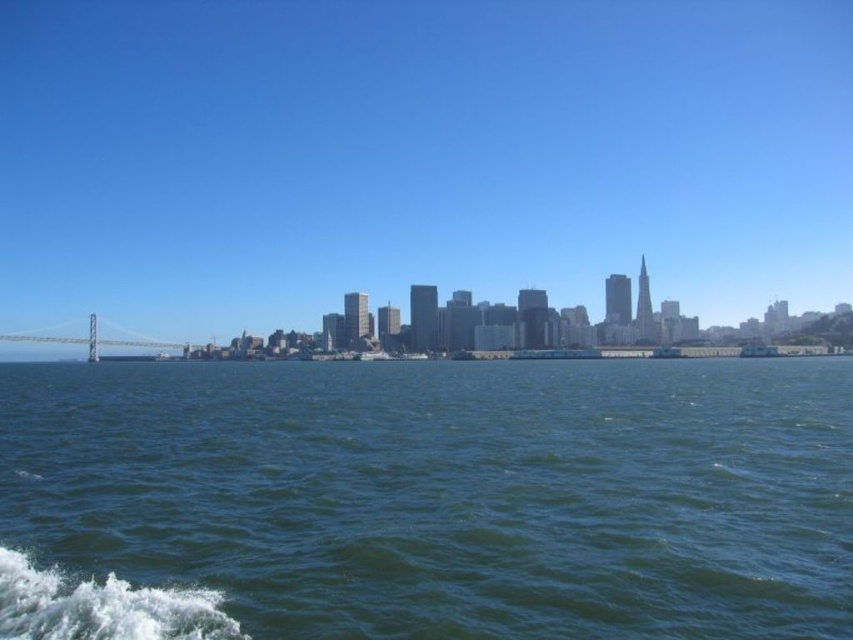
You are on a boat and want to take a photo of both the green water at center and the metallic gray bridge at left. Which object should you focus on first to ensure both are in the frame?

Since the green water at center is closer to the viewer than the metallic gray bridge at left, you should focus on the metallic gray bridge at left first to ensure both are in the frame.

You are an architect observing the city skyline from a boat. You notice the blue sky at upper center and the green water at center. Which of these two elements is located to the right when viewed from your position on the boat?

The blue sky at upper center is positioned on the right side of the green water at center, so the blue sky at upper center is located to the right.

You are a photographer planning to capture the city skyline from the boat. You notice the green water at center and the metallic gray bridge at left. Which object would you focus on if you want to include more of the scene in your shot?

The green water at center has a larger width than the metallic gray bridge at left, so focusing on it would allow you to include more of the scene in your shot.